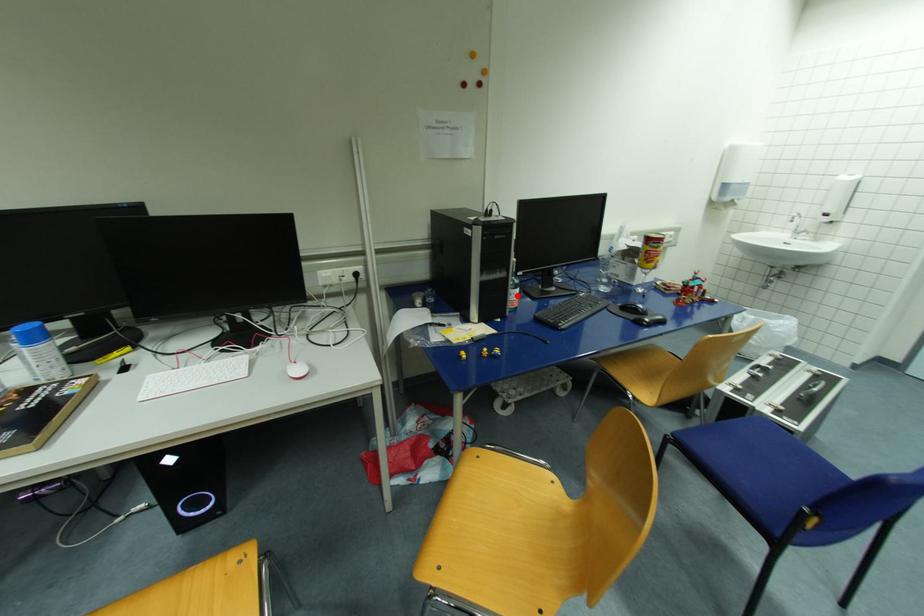
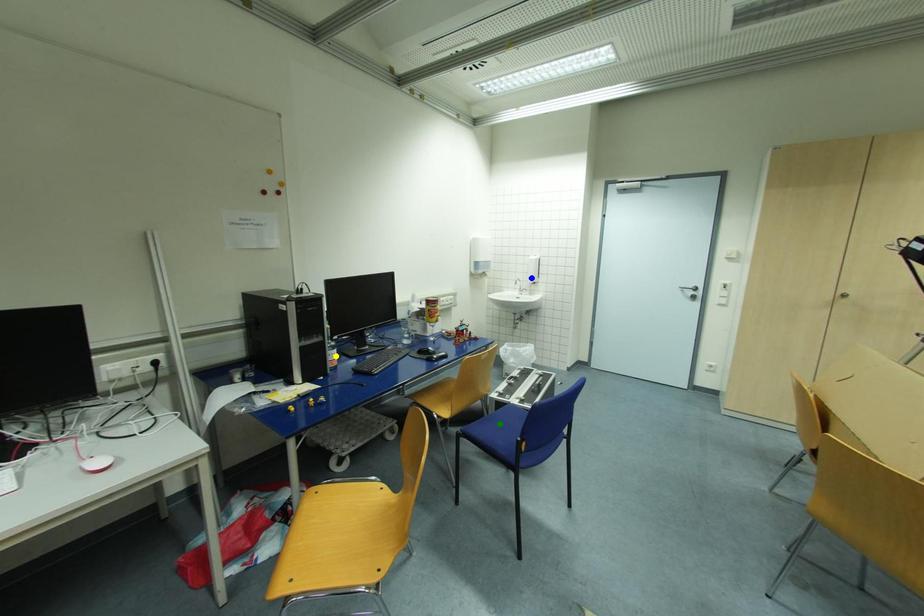
Question: I am providing you with two images of the same scene from different viewpoints. A red point is marked on the first image. You are given multiple points on the second image. Which spot in image 2 lines up with the point in image 1?

Choices:
 (A) blue point
 (B) yellow point
 (C) green point

Answer: (B)